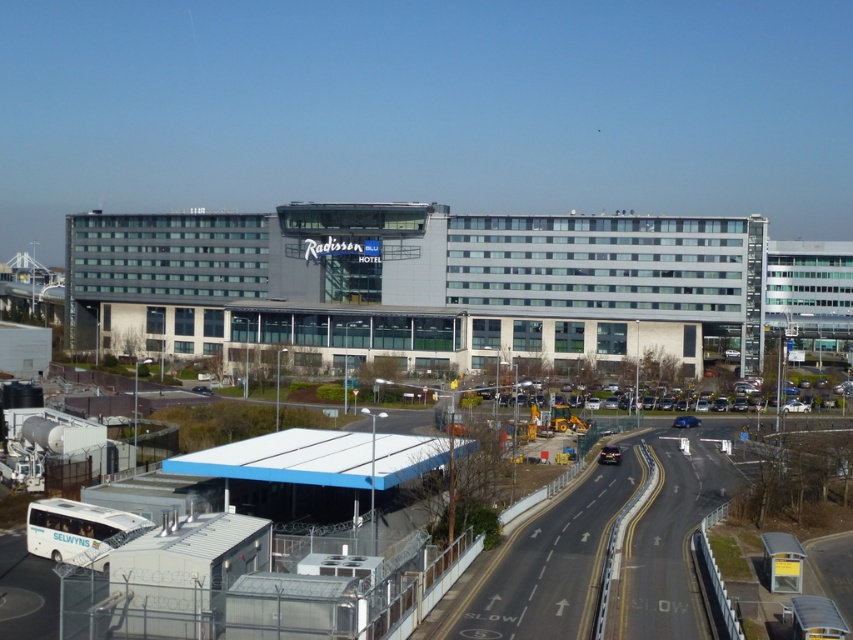
Who is higher up, gray concrete radisson blu hotel at center or white matte bus at lower left?

gray concrete radisson blu hotel at center

Does gray concrete radisson blu hotel at center appear over white matte bus at lower left?

Yes.

Who is more forward, (587, 314) or (86, 540)?

Point (86, 540) is more forward.

The width and height of the screenshot is (853, 640). What are the coordinates of `gray concrete radisson blu hotel at center` in the screenshot? It's located at click(416, 285).

The width and height of the screenshot is (853, 640). Describe the element at coordinates (416, 285) in the screenshot. I see `gray concrete radisson blu hotel at center` at that location.

Who is more distant from viewer, (160, 237) or (346, 448)?

Positioned behind is point (160, 237).

What do you see at coordinates (416, 285) in the screenshot? I see `gray concrete radisson blu hotel at center` at bounding box center [416, 285].

Find the location of a particular element. The height and width of the screenshot is (640, 853). gray concrete radisson blu hotel at center is located at coordinates pos(416,285).

Who is lower down, white matte bus station at lower left or white matte bus at lower left?

white matte bus at lower left is below.

Is white matte bus station at lower left closer to the viewer compared to white matte bus at lower left?

No, it is behind white matte bus at lower left.

Who is more distant from viewer, (405, 460) or (35, 513)?

Point (405, 460)

Identify the location of white matte bus station at lower left. pyautogui.click(x=323, y=458).